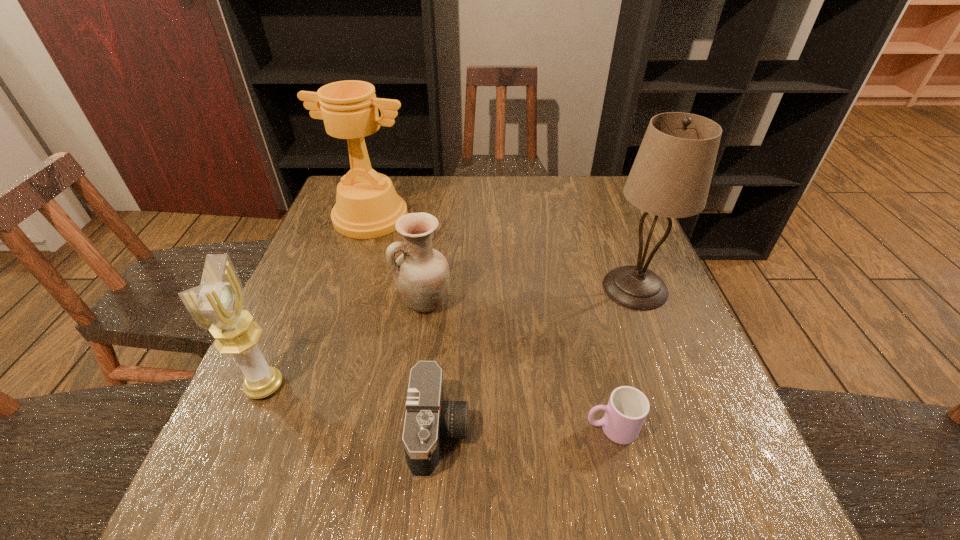
Locate an element on the screen. The width and height of the screenshot is (960, 540). blank area in the image that satisfies the following two spatial constraints: 1. on the front-facing side of the third tallest object; 2. with the handle on the side of the cup is located at coordinates (247, 428).